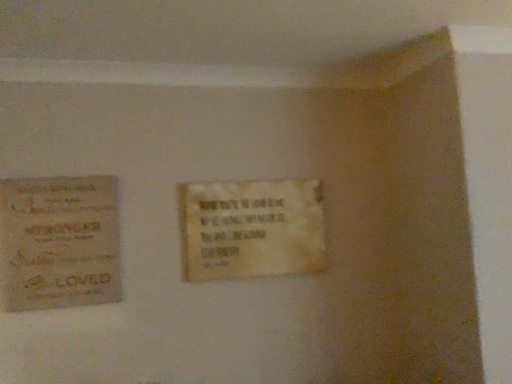
What is the approximate width of matte paper poster at left?

It is 1.89 inches.

Find the location of a particular element. This screenshot has width=512, height=384. matte paper poster at left is located at coordinates (59, 242).

What do you see at coordinates (59, 242) in the screenshot?
I see `matte paper poster at left` at bounding box center [59, 242].

This screenshot has width=512, height=384. I want to click on white paper plaque at center, so click(x=251, y=229).

Describe the element at coordinates (251, 229) in the screenshot. The height and width of the screenshot is (384, 512). I see `white paper plaque at center` at that location.

Identify the location of matte paper poster at left. This screenshot has width=512, height=384. (59, 242).

In the image, is matte paper poster at left on the left side or the right side of white paper plaque at center?

matte paper poster at left is to the left of white paper plaque at center.

Is matte paper poster at left positioned before white paper plaque at center?

Yes, matte paper poster at left is in front of white paper plaque at center.

Which is behind, point (28, 281) or point (255, 243)?

The point (255, 243) is more distant.

From the image's perspective, is matte paper poster at left over white paper plaque at center?

No, from the image's perspective, matte paper poster at left is not above white paper plaque at center.

From a real-world perspective, who is located lower, matte paper poster at left or white paper plaque at center?

In real-world perspective, matte paper poster at left is lower.

Considering the relative sizes of matte paper poster at left and white paper plaque at center in the image provided, is matte paper poster at left wider than white paper plaque at center?

Correct, the width of matte paper poster at left exceeds that of white paper plaque at center.

Is matte paper poster at left taller or shorter than white paper plaque at center?

Considering their sizes, matte paper poster at left has more height than white paper plaque at center.

Does matte paper poster at left have a larger size compared to white paper plaque at center?

No, matte paper poster at left is not bigger than white paper plaque at center.

Do you think matte paper poster at left is within white paper plaque at center, or outside of it?

matte paper poster at left cannot be found inside white paper plaque at center.

Would you say matte paper poster at left is a long distance from white paper plaque at center?

No, matte paper poster at left is not far away from white paper plaque at center.

Looking at this image, is matte paper poster at left positioned with its back to white paper plaque at center?

matte paper poster at left is not turned away from white paper plaque at center.

What's the angular difference between matte paper poster at left and white paper plaque at center's facing directions?

There is a 1.19-degree angle between the facing directions of matte paper poster at left and white paper plaque at center.

How much distance is there between matte paper poster at left and white paper plaque at center?

They are 20.20 inches apart.

Find the location of a particular element. The width and height of the screenshot is (512, 384). plaque behind the matte paper poster at left is located at coordinates (251, 229).

Considering the positions of objects white paper plaque at center and matte paper poster at left in the image provided, who is more to the right, white paper plaque at center or matte paper poster at left?

From the viewer's perspective, white paper plaque at center appears more on the right side.

Between white paper plaque at center and matte paper poster at left, which one is positioned in front?

matte paper poster at left is more forward.

Which is farther from the camera, (323, 265) or (81, 188)?

The point (323, 265) is more distant.

From the image's perspective, between white paper plaque at center and matte paper poster at left, which one is located above?

From the image's view, white paper plaque at center is above.

From a real-world perspective, who is located higher, white paper plaque at center or matte paper poster at left?

white paper plaque at center is physically above.

Considering the sizes of objects white paper plaque at center and matte paper poster at left in the image provided, who is thinner, white paper plaque at center or matte paper poster at left?

Thinner between the two is white paper plaque at center.

Considering the sizes of objects white paper plaque at center and matte paper poster at left in the image provided, who is shorter, white paper plaque at center or matte paper poster at left?

white paper plaque at center is shorter.

Is white paper plaque at center bigger or smaller than matte paper poster at left?

white paper plaque at center is bigger than matte paper poster at left.

Is white paper plaque at center inside the boundaries of matte paper poster at left, or outside?

Answer: white paper plaque at center is not enclosed by matte paper poster at left.

Is white paper plaque at center placed right next to matte paper poster at left?

No, white paper plaque at center is not next to matte paper poster at left.

Is white paper plaque at center looking in the opposite direction of matte paper poster at left?

white paper plaque at center is not turned away from matte paper poster at left.

What's the angular difference between white paper plaque at center and matte paper poster at left's facing directions?

They differ by 1.19 degrees in their facing directions.

Image resolution: width=512 pixels, height=384 pixels. Identify the location of plaque behind the matte paper poster at left. (251, 229).

Where is `plaque above the matte paper poster at left (from a real-world perspective)`? The image size is (512, 384). plaque above the matte paper poster at left (from a real-world perspective) is located at coordinates (251, 229).

The width and height of the screenshot is (512, 384). I want to click on plaque behind the matte paper poster at left, so click(251, 229).